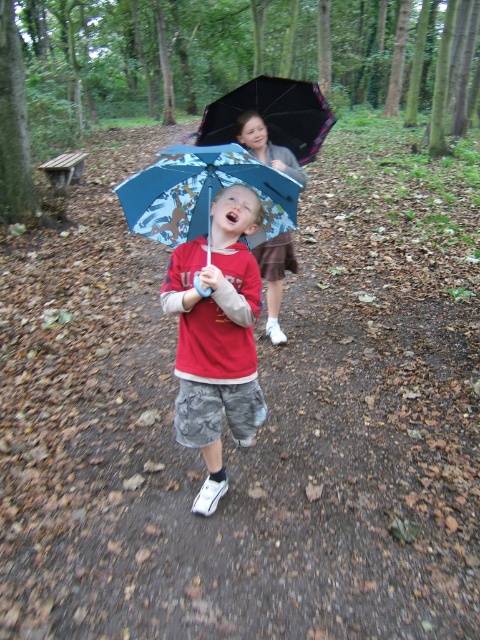
You are standing at the point marked by the coordinates (204,195) in this image. What object is located exactly at that point?

The point marked by the coordinates (204,195) corresponds to the blue fabric umbrella at center.

You are a delivery person who needs to choose an umbrella to protect yourself from the rain. You have two options in the image, the black matte umbrella at upper center and the matte blue umbrella at center. Which one should you choose based on their sizes?

The matte blue umbrella at center is wider than the black matte umbrella at upper center, so you should choose the matte blue umbrella at center to get better rain protection.

You are a delivery person who needs to choose an umbrella to protect yourself from the rain. You see a black matte umbrella at upper center and a matte blue umbrella at center. Which one should you pick if you want the taller one?

The matte blue umbrella at center is taller than the black matte umbrella at upper center, so you should pick the matte blue umbrella at center.